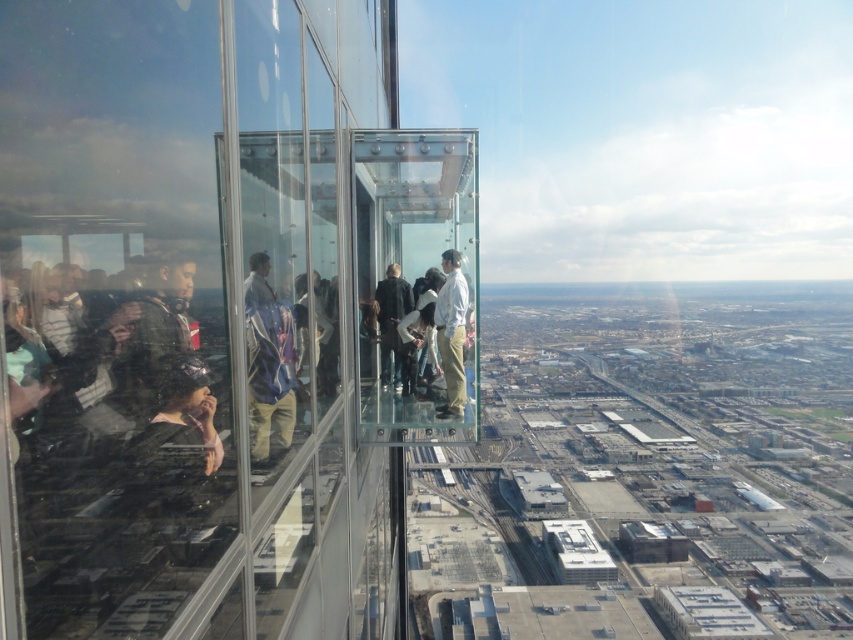
Which is below, transparent glass elevator at center or light blue shirt at center?

light blue shirt at center is lower down.

Does point (219, 289) lie in front of point (445, 301)?

Yes, it is.

At what (x,y) coordinates should I click in order to perform the action: click on transparent glass elevator at center. Please return your answer as a coordinate pair (x, y). Image resolution: width=853 pixels, height=640 pixels. Looking at the image, I should click on (209, 310).

Between transparent glass elevator at center and matte black jacket at left, which one is positioned higher?

Positioned higher is transparent glass elevator at center.

You are a GUI agent. You are given a task and a screenshot of the screen. Output one action in this format:
    pyautogui.click(x=<x>, y=<y>)
    Task: Click on the transparent glass elevator at center
    Image resolution: width=853 pixels, height=640 pixels.
    Given the screenshot: What is the action you would take?
    pyautogui.click(x=209, y=310)

Is point (392, 19) more distant than point (144, 426)?

Yes, point (392, 19) is farther from viewer.

This screenshot has height=640, width=853. Find the location of `transparent glass elevator at center`. transparent glass elevator at center is located at coordinates (209, 310).

Is blue fabric jacket at left shorter than light blue shirt at center?

No.

Describe the element at coordinates (268, 365) in the screenshot. I see `blue fabric jacket at left` at that location.

The image size is (853, 640). I want to click on blue fabric jacket at left, so click(x=268, y=365).